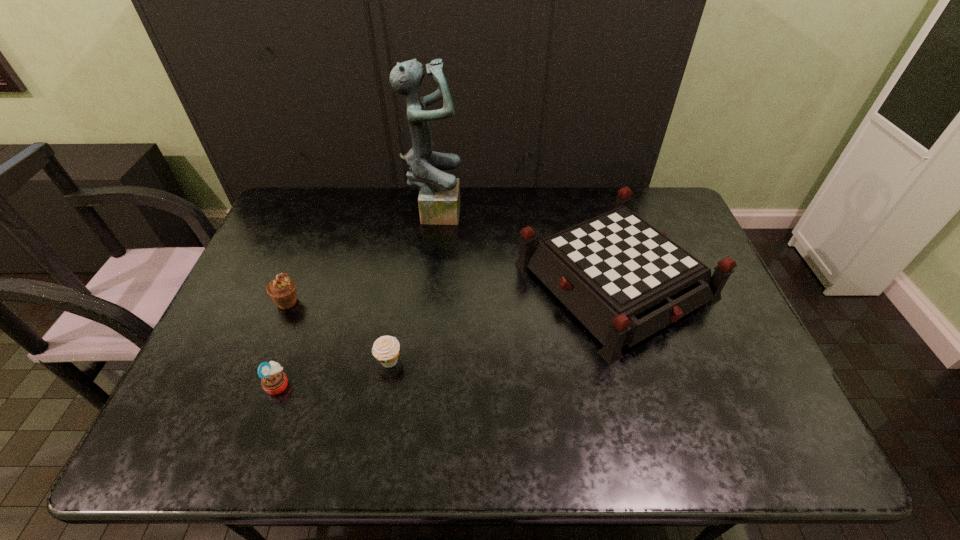
Where is `vacant space situated 0.120m on the front-facing side of the nearest muffin`? The width and height of the screenshot is (960, 540). vacant space situated 0.120m on the front-facing side of the nearest muffin is located at coordinates (340, 384).

Where is `sculpture that is at the far edge`? This screenshot has width=960, height=540. sculpture that is at the far edge is located at coordinates (439, 198).

Image resolution: width=960 pixels, height=540 pixels. Find the location of `checkerboard situated at the far edge`. checkerboard situated at the far edge is located at coordinates (624, 280).

The height and width of the screenshot is (540, 960). I want to click on object located in the left edge section of the desktop, so click(x=282, y=290).

Find the location of a particular element. Image resolution: width=960 pixels, height=540 pixels. object at the right edge is located at coordinates (624, 280).

The image size is (960, 540). I want to click on object positioned at the far right corner, so click(624, 280).

Where is `free space at the far edge of the desktop`? This screenshot has width=960, height=540. free space at the far edge of the desktop is located at coordinates (514, 189).

The image size is (960, 540). What are the coordinates of `vacant region at the near edge of the desktop` in the screenshot? It's located at (467, 424).

This screenshot has height=540, width=960. Find the location of `vacant space at the left edge`. vacant space at the left edge is located at coordinates (229, 403).

Find the location of a particular element. vacant space at the near right corner of the desktop is located at coordinates (736, 458).